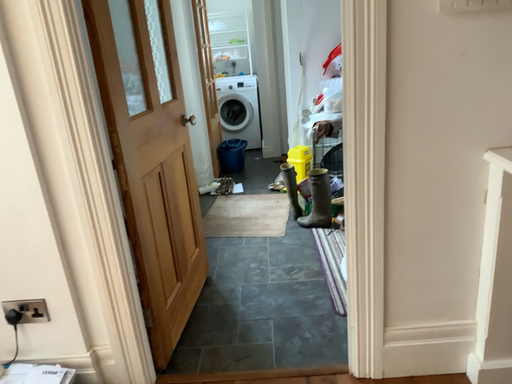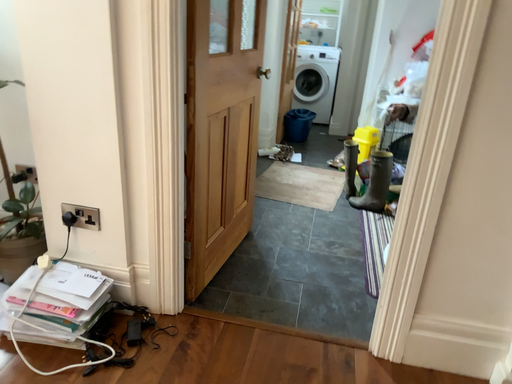
Question: How did the camera likely rotate when shooting the video?

Choices:
 (A) rotated left
 (B) rotated right

Answer: (A)